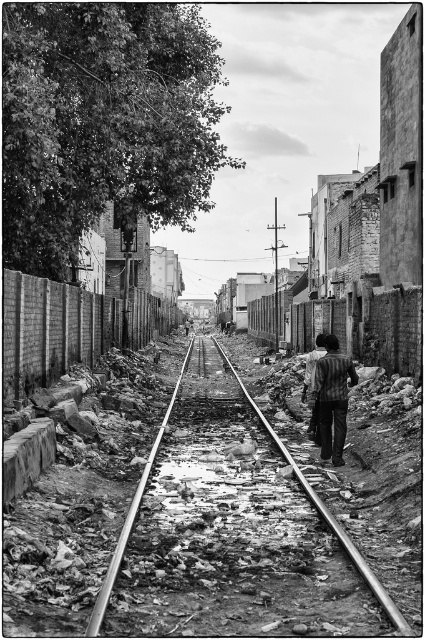
Can you confirm if smooth metal track at center is positioned above striped shirt at center?

Actually, smooth metal track at center is below striped shirt at center.

Does point (340, 531) come closer to viewer compared to point (320, 358)?

Yes, point (340, 531) is closer to viewer.

Who is more forward, (115, 572) or (346, 378)?

Positioned in front is point (115, 572).

This screenshot has height=640, width=425. Identify the location of smooth metal track at center. (325, 513).